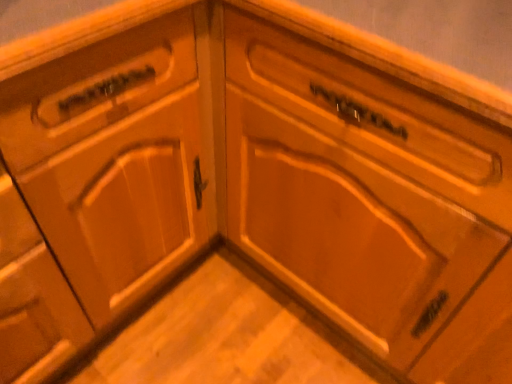
This screenshot has height=384, width=512. What do you see at coordinates (351, 231) in the screenshot?
I see `wooden drawer at center` at bounding box center [351, 231].

Where is `wooden drawer at center`? wooden drawer at center is located at coordinates (351, 231).

This screenshot has width=512, height=384. I want to click on wooden drawer at center, so click(351, 231).